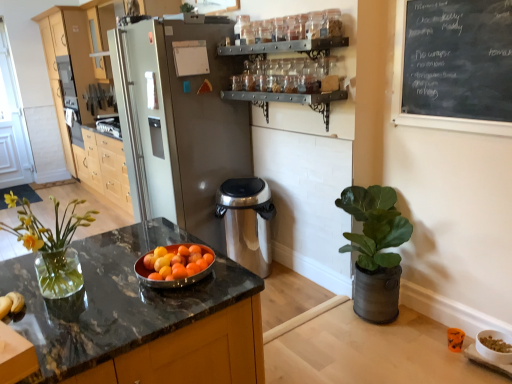
What do you see at coordinates (493, 347) in the screenshot?
I see `white glossy bowl at lower right` at bounding box center [493, 347].

This screenshot has width=512, height=384. I want to click on white glossy bowl at lower right, so click(493, 347).

The height and width of the screenshot is (384, 512). I want to click on black chalkboard at upper right, so click(425, 115).

The width and height of the screenshot is (512, 384). What do you see at coordinates (51, 246) in the screenshot? I see `clear glass vase at left` at bounding box center [51, 246].

Measure the distance between point (220,217) and camera.

Point (220,217) is 3.09 meters from camera.

The width and height of the screenshot is (512, 384). Find the location of `white glossy bowl at lower right`. white glossy bowl at lower right is located at coordinates (493, 347).

Considering the points (503, 337) and (136, 35), which point is in front, point (503, 337) or point (136, 35)?

The point (503, 337) is more forward.

From the picture: Which object is further away from the camera, white glossy bowl at lower right or satin silver refrigerator at center?

satin silver refrigerator at center is behind.

From their relative heights in the image, would you say white glossy bowl at lower right is taller or shorter than satin silver refrigerator at center?

Considering their sizes, white glossy bowl at lower right has less height than satin silver refrigerator at center.

Looking at the image, does white glossy bowl at lower right seem bigger or smaller compared to satin silver refrigerator at center?

Clearly, white glossy bowl at lower right is smaller in size than satin silver refrigerator at center.

From the image's perspective, is black marble countertop at center located above or below stainless steel trash can at center?

Based on their image positions, black marble countertop at center is located beneath stainless steel trash can at center.

From a real-world perspective, between black marble countertop at center and stainless steel trash can at center, who is vertically lower?

stainless steel trash can at center, from a real-world perspective.

Considering the points (117, 294) and (216, 200), which point is behind, point (117, 294) or point (216, 200)?

The point (216, 200) is farther.

Is white glossy bowl at lower right taller or shorter than light wood cabinetry at left?

white glossy bowl at lower right is shorter than light wood cabinetry at left.

Is white glossy bowl at lower right next to light wood cabinetry at left and touching it?

They are not placed beside each other.

Which is farther, (483, 336) or (155, 10)?

The point (155, 10) is farther from the camera.

From the image's perspective, which is below, black marble countertop at center or clear glass vase at left?

black marble countertop at center is shown below in the image.

Is black marble countertop at center outside of clear glass vase at left?

That's correct, black marble countertop at center is outside of clear glass vase at left.

Between point (123, 293) and point (27, 230), which one is positioned behind?

The point (123, 293) is farther from the camera.

Considering the sizes of black marble countertop at center and clear glass vase at left in the image, is black marble countertop at center taller or shorter than clear glass vase at left?

black marble countertop at center is taller than clear glass vase at left.

Is clear glass vase at left with green matte plant at right?

No, clear glass vase at left is not in contact with green matte plant at right.

Would you say green matte plant at right is part of clear glass vase at left's contents?

That's incorrect, green matte plant at right is not inside clear glass vase at left.

Is clear glass vase at left taller than green matte plant at right?

No.

Could you tell me if clear glass vase at left is turned towards green matte plant at right?

No, clear glass vase at left does not turn towards green matte plant at right.

Is black marble countertop at center surrounding light wood cabinetry at left?

No, light wood cabinetry at left is not inside black marble countertop at center.

Which is farther from the camera, (110, 246) or (62, 51)?

The point (62, 51) is farther from the camera.

From the image's perspective, between black marble countertop at center and light wood cabinetry at left, which one is located above?

light wood cabinetry at left, from the image's perspective.

In terms of width, does black marble countertop at center look wider or thinner when compared to light wood cabinetry at left?

Considering their sizes, black marble countertop at center looks broader than light wood cabinetry at left.

Is black marble countertop at center turned away from white glossy bowl at lower right?

No, black marble countertop at center is not facing the opposite direction of white glossy bowl at lower right.

Which object is thinner, black marble countertop at center or white glossy bowl at lower right?

Thinner between the two is white glossy bowl at lower right.

In the image, is black marble countertop at center positioned in front of or behind white glossy bowl at lower right?

black marble countertop at center is positioned closer to the viewer than white glossy bowl at lower right.

Between point (81, 361) and point (477, 350), which one is positioned behind?

The point (477, 350) is more distant.

Locate an element on the screen. The width and height of the screenshot is (512, 384). refrigerator on the left of white glossy bowl at lower right is located at coordinates (180, 119).

Where is `appliance that is on the right side of black marble countertop at center`? The height and width of the screenshot is (384, 512). appliance that is on the right side of black marble countertop at center is located at coordinates (247, 222).

Estimate the real-world distances between objects in this image. Which object is closer to black marble countertop at center, stainless steel trash can at center or green matte plant at right?

green matte plant at right lies closer to black marble countertop at center than the other object.

From the image, which object appears to be farther from light wood cabinetry at left, stainless steel trash can at center or clear glass vase at left?

clear glass vase at left lies further to light wood cabinetry at left than the other object.

When comparing their distances from satin silver refrigerator at center, does black marble countertop at center or clear glass vase at left seem closer?

The object closer to satin silver refrigerator at center is black marble countertop at center.

Considering their positions, is black chalkboard at upper right positioned further to green matte plant at right than black marble countertop at center?

The object further to green matte plant at right is black marble countertop at center.

When comparing their distances from clear glass vase at left, does light wood cabinetry at left or satin silver refrigerator at center seem closer?

Among the two, satin silver refrigerator at center is located nearer to clear glass vase at left.

Which object lies nearer to the anchor point green matte plant at right, satin silver refrigerator at center or black chalkboard at upper right?

black chalkboard at upper right lies closer to green matte plant at right than the other object.

Considering their positions, is light wood cabinetry at left positioned closer to green matte plant at right than white glossy bowl at lower right?

The object closer to green matte plant at right is white glossy bowl at lower right.

Considering their positions, is clear glass vase at left positioned further to light wood cabinetry at left than stainless steel trash can at center?

Based on the image, clear glass vase at left appears to be further to light wood cabinetry at left.

Where is `houseplant located between clear glass vase at left and black chalkboard at upper right in the left-right direction`? This screenshot has height=384, width=512. houseplant located between clear glass vase at left and black chalkboard at upper right in the left-right direction is located at coordinates (375, 250).

Locate an element on the screen. The image size is (512, 384). bulletin board located between clear glass vase at left and light wood cabinetry at left in the depth direction is located at coordinates (425, 115).

Image resolution: width=512 pixels, height=384 pixels. I want to click on countertop between satin silver refrigerator at center and black chalkboard at upper right from left to right, so click(x=113, y=304).

The height and width of the screenshot is (384, 512). What are the coordinates of `houseplant between black chalkboard at upper right and white glossy bowl at lower right in the vertical direction` in the screenshot? It's located at (375, 250).